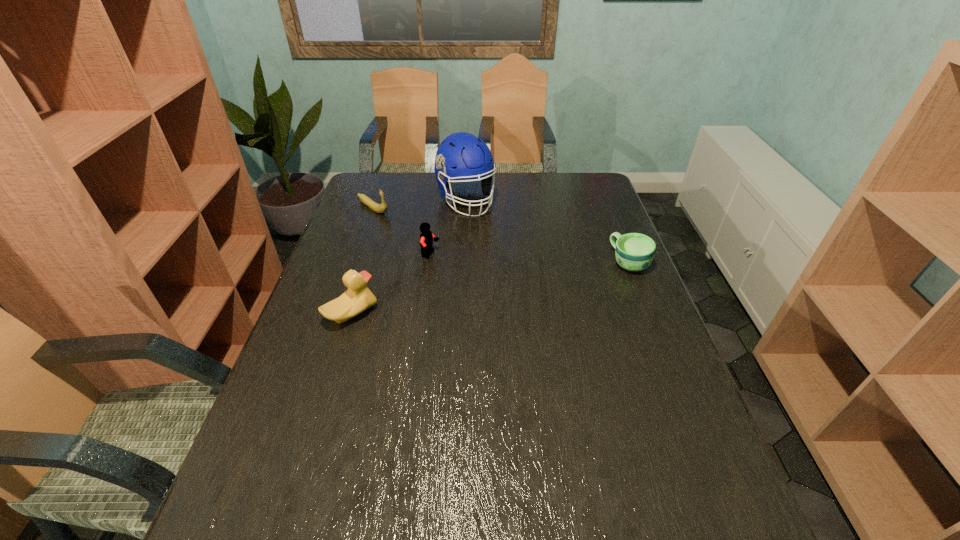
Identify the location of empty space that is in between the banana and the nearest object. (362, 261).

Find the location of a particular element. This screenshot has width=960, height=540. vacant space that is in between the Lego and the tallest object is located at coordinates click(448, 227).

Image resolution: width=960 pixels, height=540 pixels. I want to click on free space that is in between the shortest object and the duck, so pos(491,288).

At what (x,y) coordinates should I click in order to perform the action: click on vacant area that lies between the nearest object and the banana. Please return your answer as a coordinate pair (x, y). The height and width of the screenshot is (540, 960). Looking at the image, I should click on (362, 261).

Where is `vacant region between the Lego and the shortest object`? This screenshot has width=960, height=540. vacant region between the Lego and the shortest object is located at coordinates (530, 259).

This screenshot has height=540, width=960. I want to click on empty space that is in between the duck and the rightmost object, so click(x=491, y=288).

Where is `free space that is in between the Lego and the banana`? This screenshot has height=540, width=960. free space that is in between the Lego and the banana is located at coordinates (401, 232).

The height and width of the screenshot is (540, 960). I want to click on free space between the Lego and the nearest object, so click(391, 285).

Select which object appears as the second closest to the tallest object. Please provide its 2D coordinates. Your answer should be formatted as a tuple, i.e. [(x, y)], where the tuple contains the x and y coordinates of a point satisfying the conditions above.

[(426, 237)]

Select which object is the fourth closest to the rightmost object. Please provide its 2D coordinates. Your answer should be formatted as a tuple, i.e. [(x, y)], where the tuple contains the x and y coordinates of a point satisfying the conditions above.

[(380, 208)]